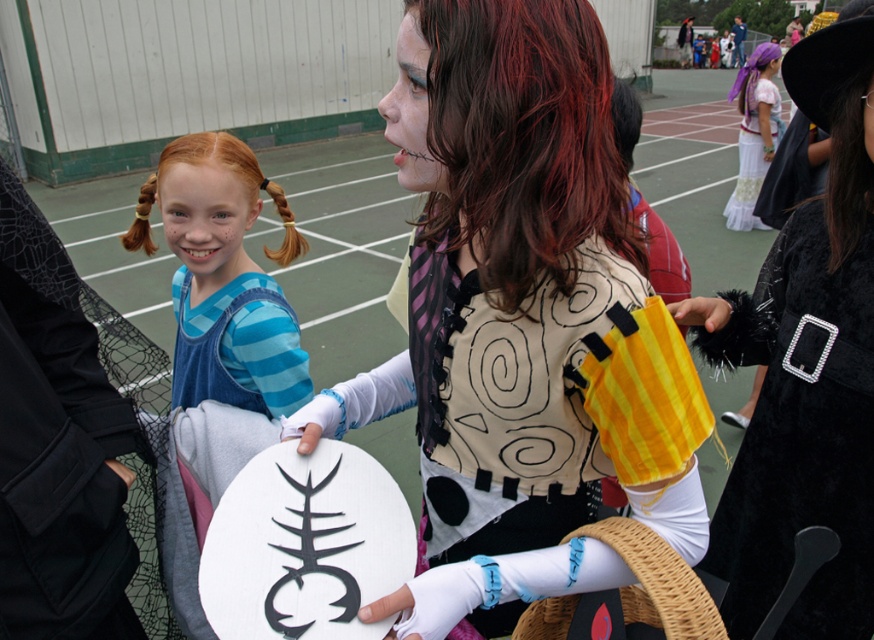
You are organizing a costume party and need to arrange the blue striped shirt at center and the white cotton dress at upper right in a display. Which costume takes up more space when displayed?

The white cotton dress at upper right takes up more space than the blue striped shirt at center because the blue striped shirt at center occupies less space than white cotton dress at upper right.

You are standing at the center of the sports field and want to place a new decoration exactly where the matte black vest at center is located. What are the coordinates where you should place the decoration?

The coordinates for placing the decoration should be at point (500,300), as that is the 2D location of the matte black vest at center.